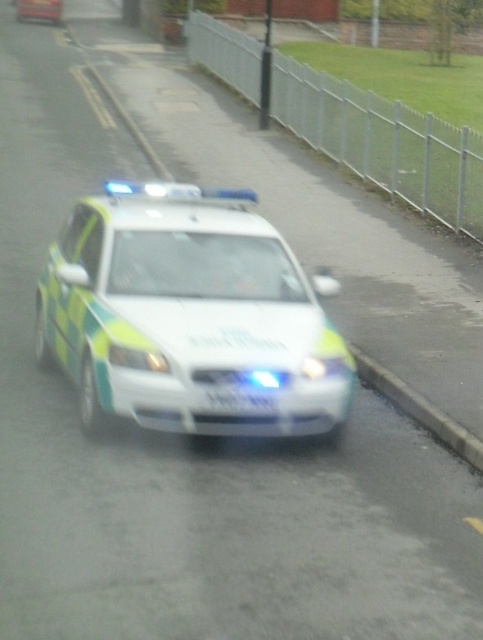
Question: In this image, where is concrete at lower right located relative to white plastic license plate at center?

Choices:
 (A) above
 (B) below

Answer: (B)

Question: Which of the following is the farthest from the observer?

Choices:
 (A) concrete at lower right
 (B) green/yellow painted police car at center
 (C) white plastic license plate at center

Answer: (A)

Question: Which object is farther from the camera taking this photo?

Choices:
 (A) concrete at lower right
 (B) white plastic license plate at center
 (C) green/yellow painted police car at center

Answer: (A)

Question: Is concrete at lower right positioned at the back of white plastic license plate at center?

Choices:
 (A) no
 (B) yes

Answer: (B)

Question: Can you confirm if green/yellow painted police car at center is positioned to the left of white plastic license plate at center?

Choices:
 (A) yes
 (B) no

Answer: (A)

Question: Which of these objects is positioned closest to the white plastic license plate at center?

Choices:
 (A) concrete at lower right
 (B) green/yellow painted police car at center

Answer: (B)